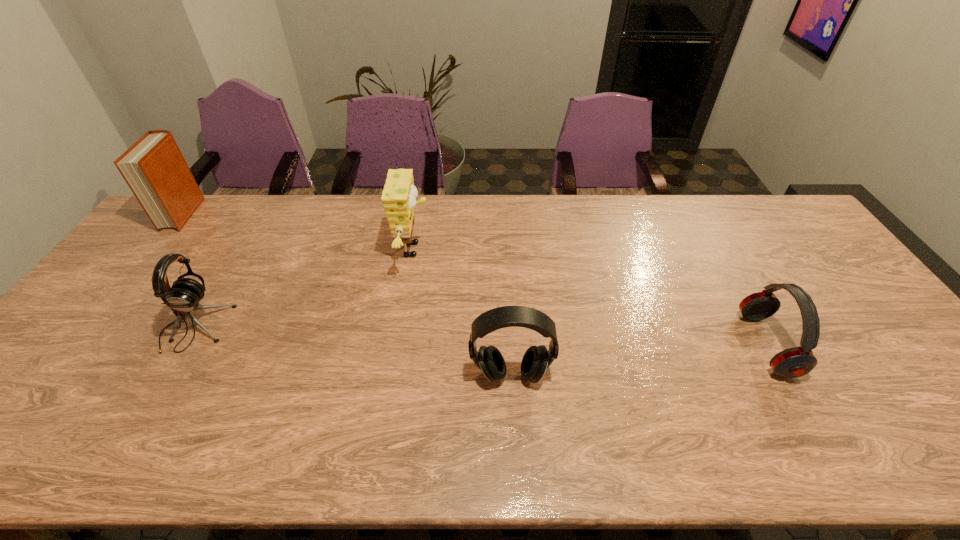
Locate which earphone ranks third in proximity to the hardback book. Please provide its 2D coordinates. Your answer should be formatted as a tuple, i.e. [(x, y)], where the tuple contains the x and y coordinates of a point satisfying the conditions above.

[(794, 362)]

Locate an element on the screen. Image resolution: width=960 pixels, height=540 pixels. earphone that is the closest to the shortest object is located at coordinates (537, 359).

I want to click on vacant space that satisfies the following two spatial constraints: 1. on the open cover of the hardback book; 2. on the left side of the second object from left to right, so click(x=93, y=328).